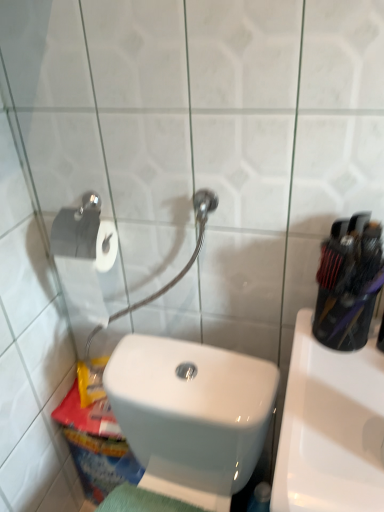
Question: From the image's perspective, is white glossy toilet at lower left on white glossy sink at right?

Choices:
 (A) no
 (B) yes

Answer: (A)

Question: Can you confirm if white glossy toilet at lower left is wider than white glossy sink at right?

Choices:
 (A) no
 (B) yes

Answer: (A)

Question: From a real-world perspective, is white glossy toilet at lower left positioned over white glossy sink at right based on gravity?

Choices:
 (A) no
 (B) yes

Answer: (B)

Question: Could white glossy sink at right be considered to be inside white glossy toilet at lower left?

Choices:
 (A) no
 (B) yes

Answer: (A)

Question: Considering the relative sizes of white glossy toilet at lower left and white glossy sink at right in the image provided, is white glossy toilet at lower left bigger than white glossy sink at right?

Choices:
 (A) yes
 (B) no

Answer: (A)

Question: Is white glossy toilet at lower left further to the viewer compared to white glossy sink at right?

Choices:
 (A) no
 (B) yes

Answer: (A)

Question: From the image's perspective, does white glossy sink at right appear higher than white glossy toilet at lower left?

Choices:
 (A) yes
 (B) no

Answer: (A)

Question: Is white glossy sink at right placed right next to white glossy toilet at lower left?

Choices:
 (A) yes
 (B) no

Answer: (B)

Question: From the image's perspective, is white glossy sink at right beneath white glossy toilet at lower left?

Choices:
 (A) yes
 (B) no

Answer: (B)

Question: Can you confirm if white glossy sink at right is positioned to the right of white glossy toilet at lower left?

Choices:
 (A) no
 (B) yes

Answer: (B)

Question: Is white glossy sink at right facing away from white glossy toilet at lower left?

Choices:
 (A) yes
 (B) no

Answer: (B)

Question: Can you confirm if white glossy sink at right is positioned to the left of white glossy toilet at lower left?

Choices:
 (A) yes
 (B) no

Answer: (B)

Question: Is point (170, 467) closer or farther from the camera than point (362, 411)?

Choices:
 (A) farther
 (B) closer

Answer: (A)